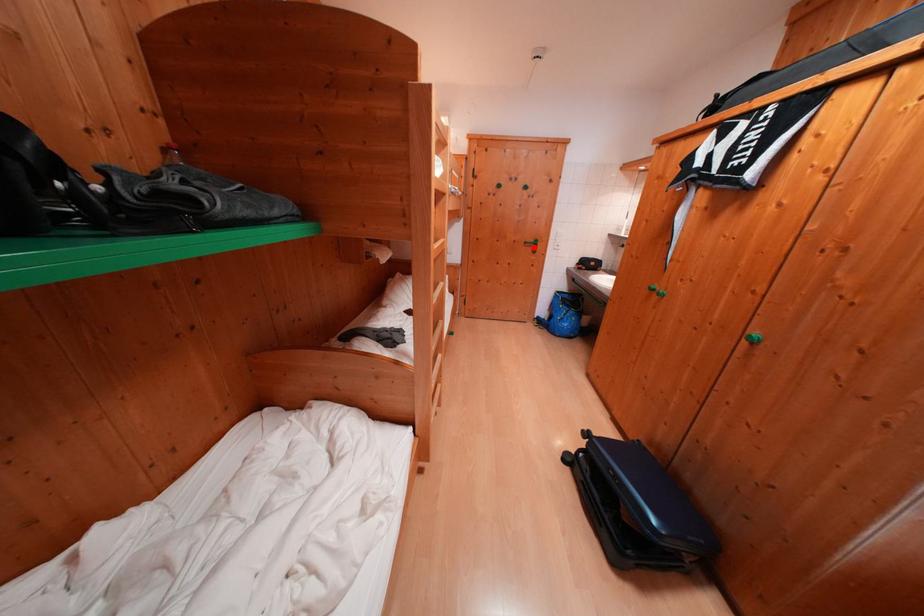
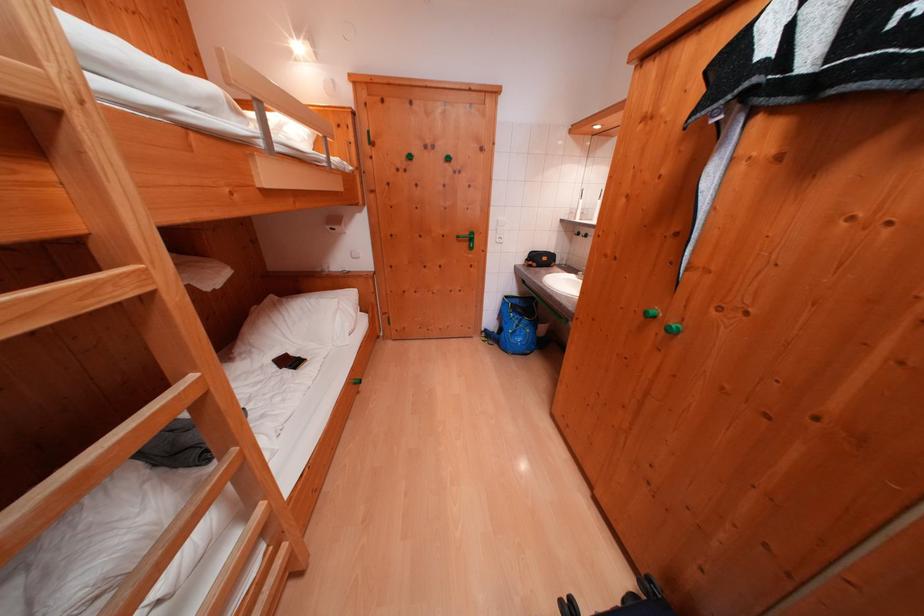
Question: I am providing you with two images of the same scene from different viewpoints. A red point is shown in image1. For the corresponding object point in image2, is it positioned nearer or farther from the camera?

Choices:
 (A) Nearer
 (B) Farther

Answer: (A)